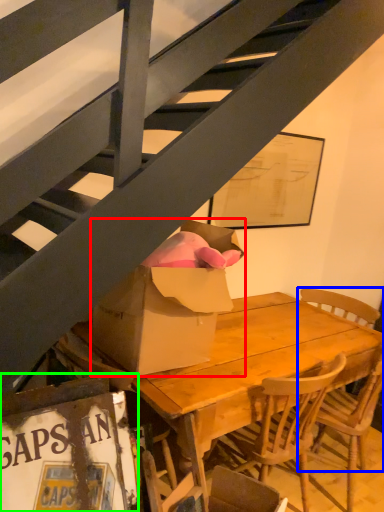
Question: Which object is positioned closest to box (highlighted by a red box)? Select from chair (highlighted by a blue box) and picture frame (highlighted by a green box).

Choices:
 (A) chair
 (B) picture frame

Answer: (B)